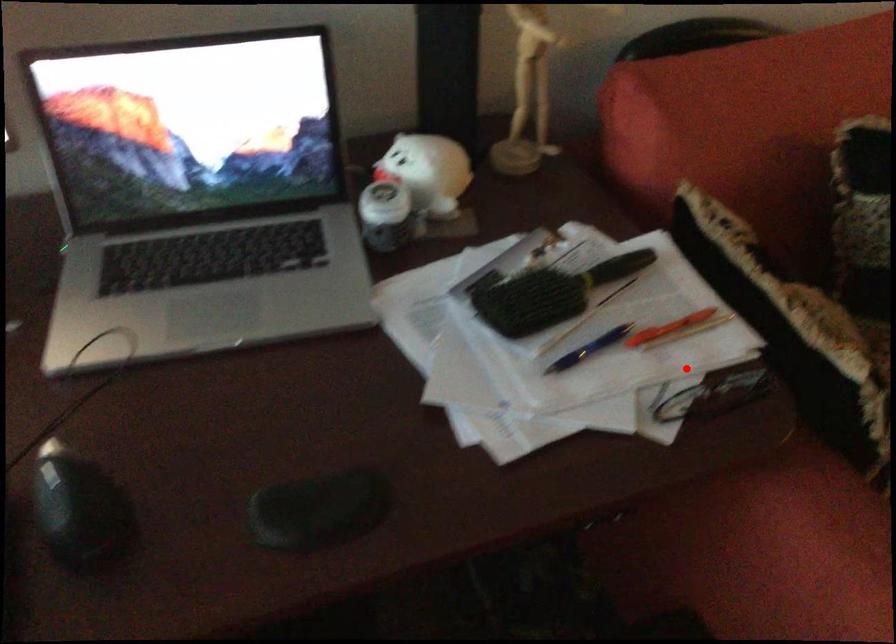
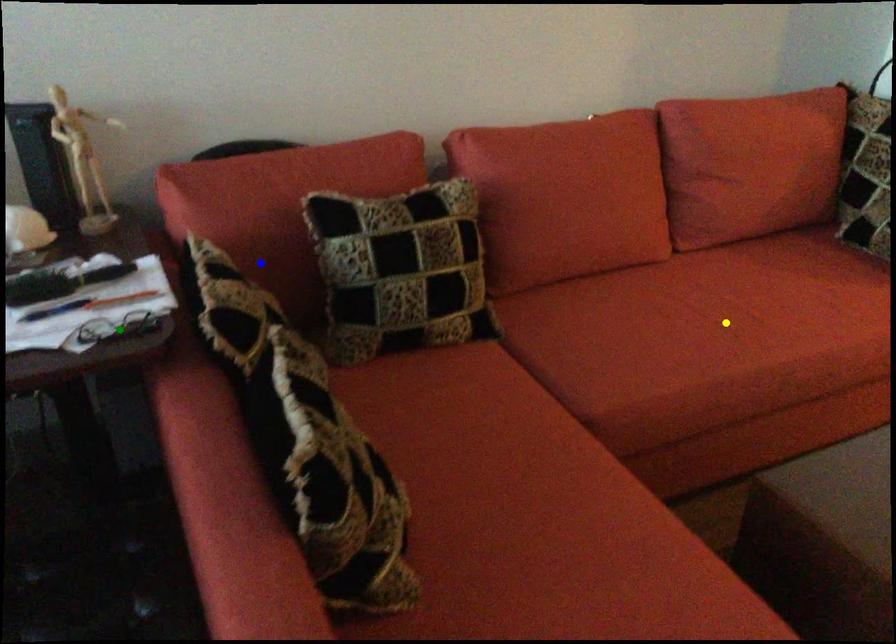
Question: I am providing you with two images of the same scene from different viewpoints. A red point is marked on the first image. You are given multiple points on the second image. In image 2, which mark is for the same physical point as the one in image 1?

Choices:
 (A) blue point
 (B) yellow point
 (C) green point

Answer: (C)